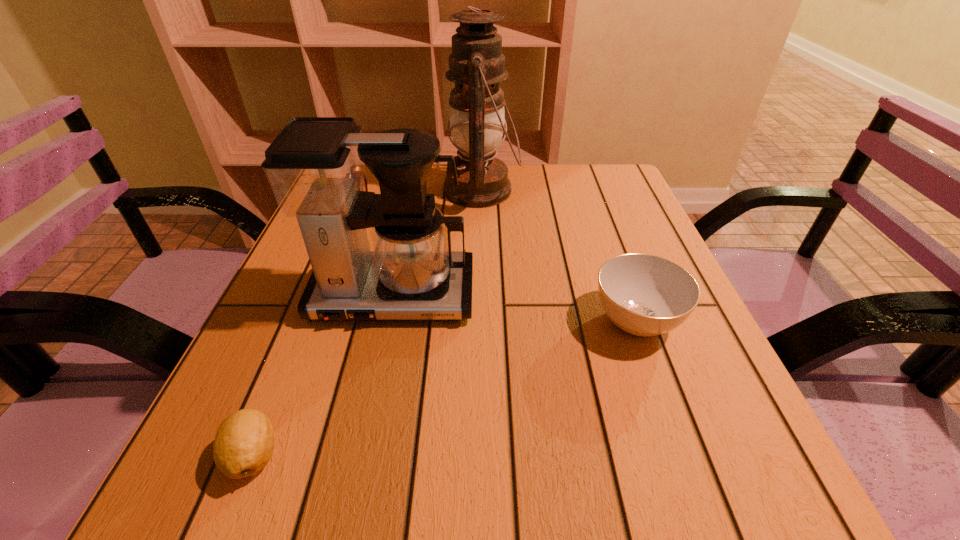
The height and width of the screenshot is (540, 960). Identify the location of vacant space at the far edge of the desktop. (548, 176).

Where is `vacant space at the near edge of the desktop`? Image resolution: width=960 pixels, height=540 pixels. vacant space at the near edge of the desktop is located at coordinates (599, 464).

What are the coordinates of `free location at the left edge` in the screenshot? It's located at (275, 410).

Where is `vacant space at the right edge of the desktop`? vacant space at the right edge of the desktop is located at coordinates (682, 397).

Locate an element on the screen. free space at the near left corner is located at coordinates click(259, 507).

Locate an element on the screen. This screenshot has height=540, width=960. blank region between the third tallest object and the shortest object is located at coordinates coord(305,330).

The width and height of the screenshot is (960, 540). I want to click on vacant space that is in between the rightmost object and the third shortest object, so click(496, 263).

Where is `free area in between the rightmost object and the coffee maker`? The image size is (960, 540). free area in between the rightmost object and the coffee maker is located at coordinates (515, 309).

Locate an element on the screen. free area in between the rightmost object and the nearest object is located at coordinates (444, 388).

You are a GUI agent. You are given a task and a screenshot of the screen. Output one action in this format:
    pyautogui.click(x=<x>, y=<y>)
    Task: Click on the free space between the nearest object and the lantern
    This screenshot has width=960, height=540.
    Given the screenshot: What is the action you would take?
    pyautogui.click(x=368, y=322)